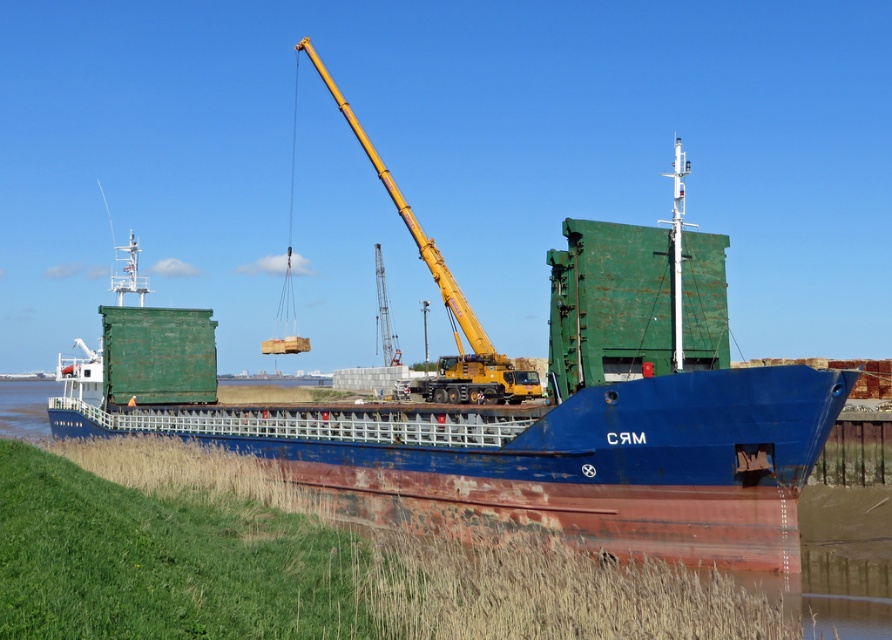
Question: Among these points, which one is farthest from the camera?

Choices:
 (A) (329, 80)
 (B) (416, 480)
 (C) (105, 445)

Answer: (A)

Question: Does green grass at lower left appear over yellow metallic crane at center?

Choices:
 (A) yes
 (B) no

Answer: (B)

Question: Observing the image, what is the correct spatial positioning of rusty metal barge at center in reference to green grass at lower left?

Choices:
 (A) above
 (B) below

Answer: (A)

Question: Which of the following is the closest to the observer?

Choices:
 (A) (48, 445)
 (B) (683, 420)
 (C) (448, 364)

Answer: (B)

Question: Which is farther from the rusty metal barge at center?

Choices:
 (A) green grass at lower left
 (B) yellow metallic crane at center

Answer: (B)

Question: Does green grass at lower left have a smaller size compared to yellow metallic crane at center?

Choices:
 (A) yes
 (B) no

Answer: (A)